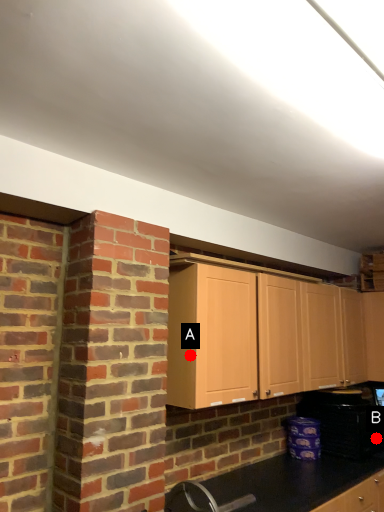
Question: Two points are circled on the image, labeled by A and B beside each circle. Which point is farther from the camera taking this photo?

Choices:
 (A) A is further
 (B) B is further

Answer: (B)